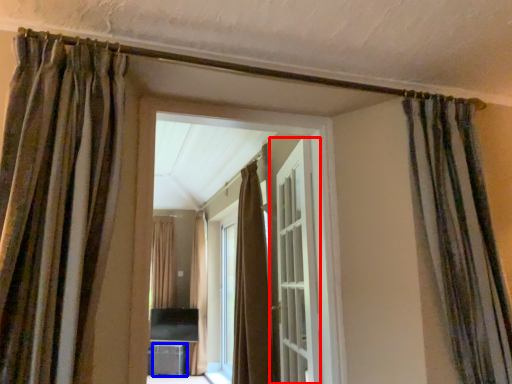
Question: Which object appears closest to the camera in this image, door (highlighted by a red box) or furniture (highlighted by a blue box)?

Choices:
 (A) door
 (B) furniture

Answer: (A)